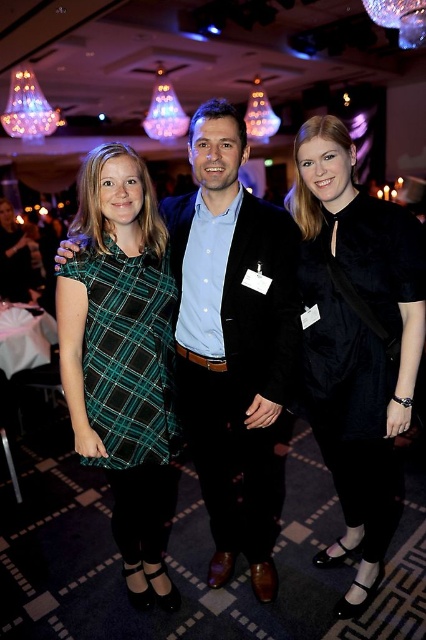
You are a photographer at the event and need to adjust the lighting to highlight both the matte black suit at center and the velvet black dress at center. Since they are positioned close to each other, you must ensure the lighting doesn not cause shadows between them. Based on their positions, which one is closer to the left side so you can angle the light accordingly?

The matte black suit at center is to the left of the velvet black dress at center, so it is closer to the left side. Angle the light towards the left to avoid shadows between them.

You are a photographer at the event and need to position two guests for a photo. You have a matte black suit at center and a velvet black dress at center. Which of the two requires more space to accommodate their outfit?

The velvet black dress at center requires more space because it is wider than the matte black suit at center.

Based on the photo, you are standing in the banquet hall and see two points marked in the image. Which point is closer to you, point (206, 472) or point (126, 512)?

Point (206, 472) is further to the viewer than point (126, 512), so point (206, 472) is closer to you.